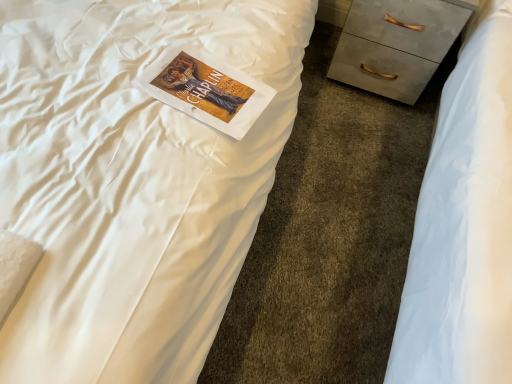
Locate an element on the screen. vacant space situated above matte white paperback book at center (from a real-world perspective) is located at coordinates (206, 84).